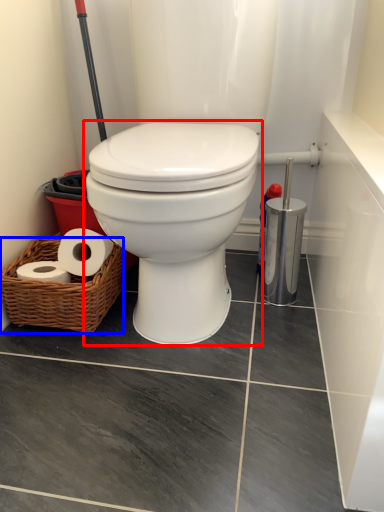
Question: Which object is closer to the camera taking this photo, toilet (highlighted by a red box) or basket (highlighted by a blue box)?

Choices:
 (A) toilet
 (B) basket

Answer: (A)